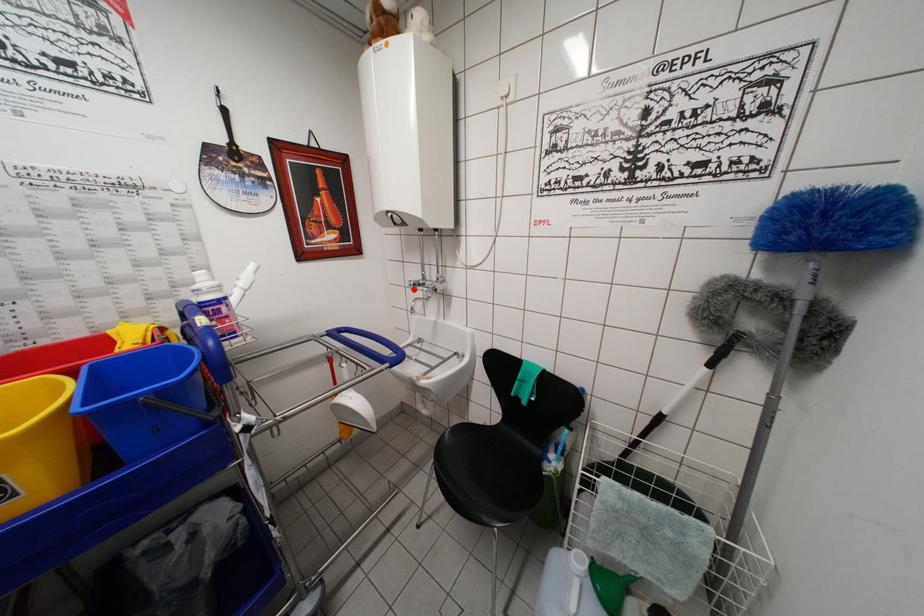
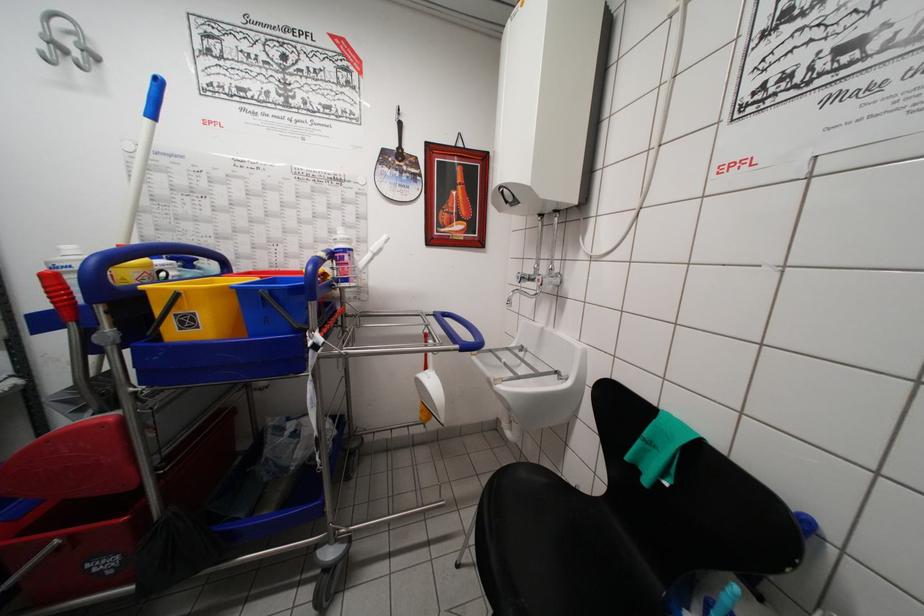
Question: I am providing you with two images of the same scene from different viewpoints. A red point is marked on the first image. At the location where the point appears in image 1, is it still visible in image 2?

Choices:
 (A) Yes
 (B) No

Answer: (A)